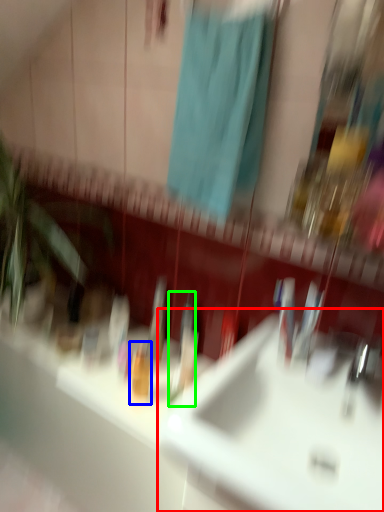
Question: Which object is the closest to the sink (highlighted by a red box)? Choose among these: toiletry (highlighted by a blue box) or toothbrush (highlighted by a green box).

Choices:
 (A) toiletry
 (B) toothbrush

Answer: (B)